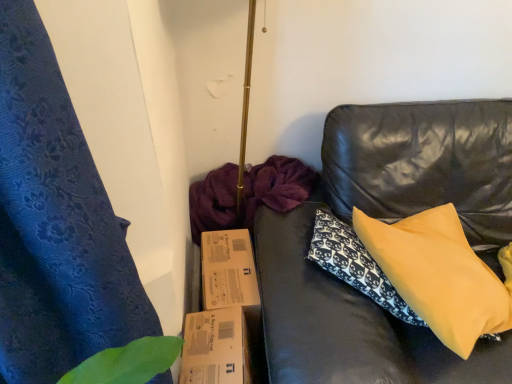
Question: Is yellow fabric pillow at right situated inside brown cardboard box at lower center or outside?

Choices:
 (A) outside
 (B) inside

Answer: (A)

Question: Does point tap(420, 283) appear closer or farther from the camera than point tap(233, 324)?

Choices:
 (A) closer
 (B) farther

Answer: (A)

Question: Looking at their shapes, would you say yellow fabric pillow at right is wider or thinner than brown cardboard box at lower center?

Choices:
 (A) wide
 (B) thin

Answer: (B)

Question: From the image's perspective, is brown cardboard box at lower center positioned above or below yellow fabric pillow at right?

Choices:
 (A) below
 (B) above

Answer: (A)

Question: Do you think brown cardboard box at lower center is within yellow fabric pillow at right, or outside of it?

Choices:
 (A) inside
 (B) outside

Answer: (B)

Question: Looking at their shapes, would you say brown cardboard box at lower center is wider or thinner than yellow fabric pillow at right?

Choices:
 (A) thin
 (B) wide

Answer: (B)

Question: Considering their positions, is brown cardboard box at lower center located in front of or behind yellow fabric pillow at right?

Choices:
 (A) front
 (B) behind

Answer: (B)